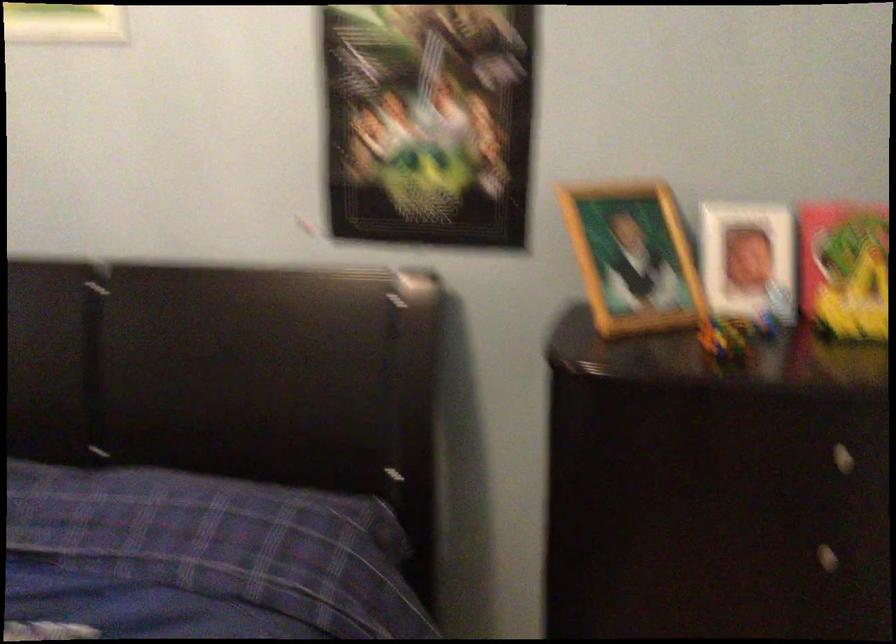
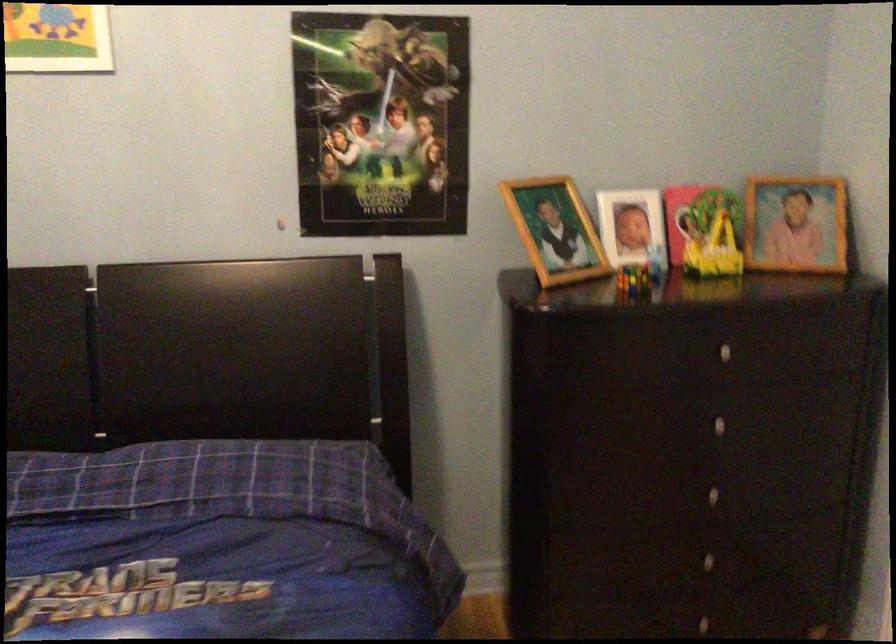
The point at (720, 339) is marked in the first image. Where is the corresponding point in the second image?

(634, 279)